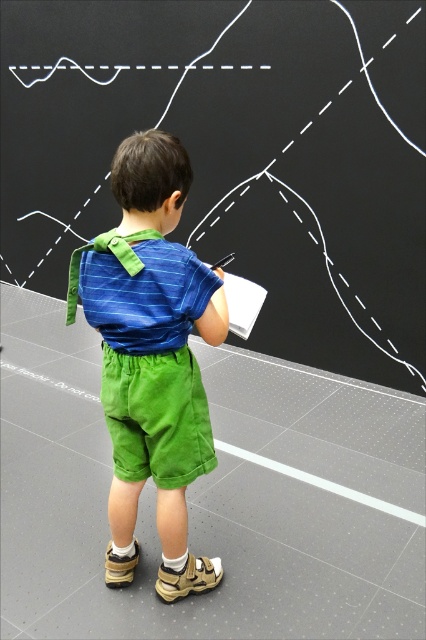
The height and width of the screenshot is (640, 426). What do you see at coordinates (152, 356) in the screenshot?
I see `blue striped shirt at center` at bounding box center [152, 356].

Does blue striped shirt at center appear on the left side of green corduroy shorts at center?

Indeed, blue striped shirt at center is positioned on the left side of green corduroy shorts at center.

Is point (131, 432) closer to camera compared to point (135, 378)?

No, it is not.

The width and height of the screenshot is (426, 640). Identify the location of blue striped shirt at center. (152, 356).

Is blue striped shirt at center smaller than blue striped shirt at back?

No, blue striped shirt at center is not smaller than blue striped shirt at back.

You are a GUI agent. You are given a task and a screenshot of the screen. Output one action in this format:
    pyautogui.click(x=<x>, y=<y>)
    Task: Click on the blue striped shirt at center
    The image size is (426, 640).
    Given the screenshot: What is the action you would take?
    [x=152, y=356]

Consider the image. Measure the distance between blue striped shirt at center and camera.

1.36 meters

At what (x,y) coordinates should I click in order to perform the action: click on blue striped shirt at center. Please return your answer as a coordinate pair (x, y). The width and height of the screenshot is (426, 640). Looking at the image, I should click on (152, 356).

Does blue striped shirt at back appear on the left side of green corduroy shorts at center?

Yes, blue striped shirt at back is to the left of green corduroy shorts at center.

Between point (155, 317) and point (138, 371), which one is positioned behind?

The point (138, 371) is behind.

Does point (118, 273) come closer to viewer compared to point (132, 468)?

Yes, it is in front of point (132, 468).

Where is `blue striped shirt at back`? blue striped shirt at back is located at coordinates (138, 291).